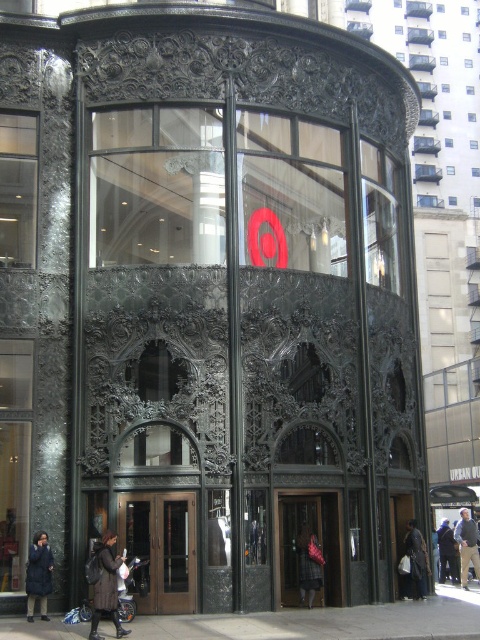
You are standing on the sidewalk and see the wooden door at center and the dark brown leather coat at lower left. Which object is closer to you?

The dark brown leather coat at lower left is closer to you because the wooden door at center is further away.

You are standing on the sidewalk in front of the building and want to walk to the entrance. There are two points marked on the ground. The first point is at coordinate point(286, 531) and the second is at point(101, 572). Which point is closer to the entrance?

Point(101, 572) is closer to the entrance because it is in front of point(286, 531).

You are standing on the sidewalk in front of the building and see both the wooden door at center and the dark brown leather coat at lower right. Which object is closer to the left side of the sidewalk?

The wooden door at center is positioned on the left side of the dark brown leather coat at lower right, so the wooden door at center is closer to the left side of the sidewalk.